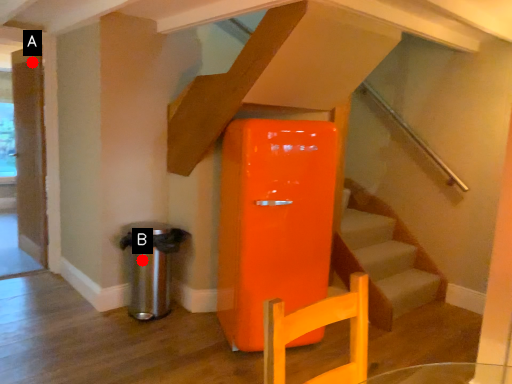
Question: Two points are circled on the image, labeled by A and B beside each circle. Which point appears closest to the camera in this image?

Choices:
 (A) A is closer
 (B) B is closer

Answer: (B)